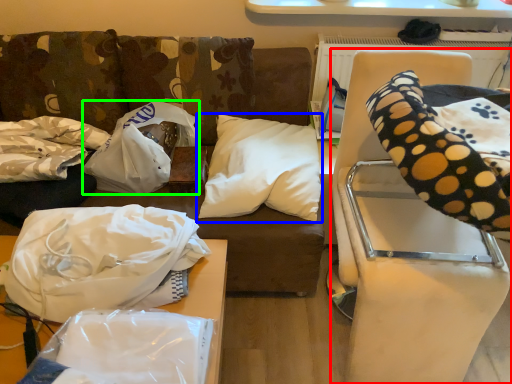
Question: Which is farther away from furniture (highlighted by a red box)? pillow (highlighted by a blue box) or material (highlighted by a green box)?

Choices:
 (A) pillow
 (B) material

Answer: (B)